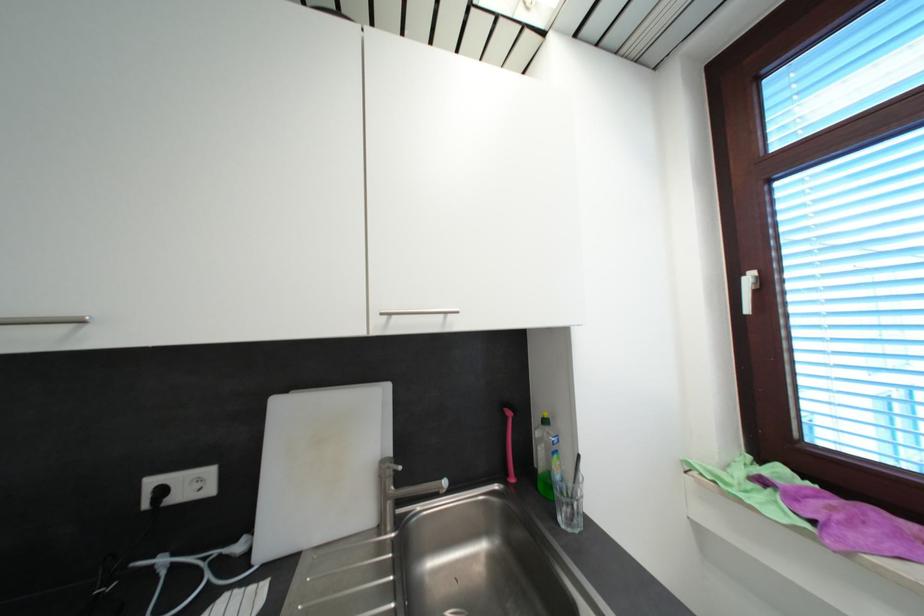
Where is `clear glass`? This screenshot has width=924, height=616. clear glass is located at coordinates (x=568, y=505).